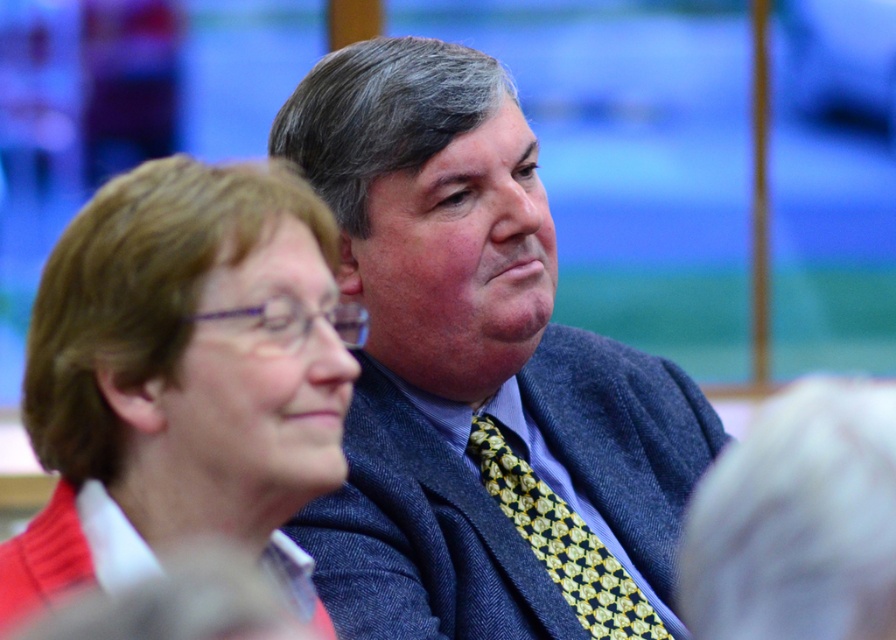
Which is more to the right, blue wool suit at center or yellow dotted tie at center?

A: From the viewer's perspective, yellow dotted tie at center appears more on the right side.

Between blue wool suit at center and yellow dotted tie at center, which one is positioned lower?

yellow dotted tie at center

Image resolution: width=896 pixels, height=640 pixels. Describe the element at coordinates (479, 376) in the screenshot. I see `blue wool suit at center` at that location.

Where is `blue wool suit at center`? blue wool suit at center is located at coordinates (479, 376).

Who is lower down, blue wool suit at center or matte red sweater at center-left?

matte red sweater at center-left is below.

Between point (386, 442) and point (235, 524), which one is positioned in front?

Point (235, 524)

Where is `blue wool suit at center`? The image size is (896, 640). blue wool suit at center is located at coordinates (479, 376).

Does matte red sweater at center-left have a lesser height compared to yellow dotted tie at center?

In fact, matte red sweater at center-left may be taller than yellow dotted tie at center.

From the picture: Does matte red sweater at center-left appear on the left side of yellow dotted tie at center?

Correct, you'll find matte red sweater at center-left to the left of yellow dotted tie at center.

Locate an element on the screen. The image size is (896, 640). matte red sweater at center-left is located at coordinates (182, 378).

The image size is (896, 640). I want to click on matte red sweater at center-left, so click(x=182, y=378).